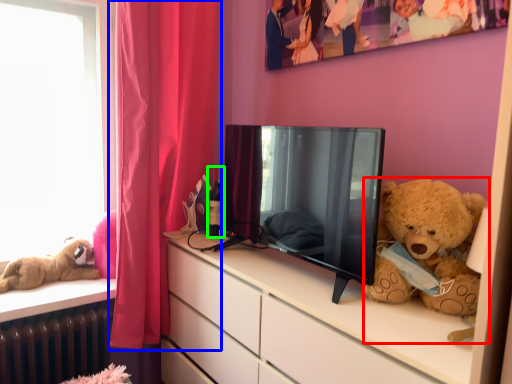
Question: Considering the real-world distances, which object is closest to teddy bear (highlighted by a red box)? curtain (highlighted by a blue box) or bottle (highlighted by a green box).

Choices:
 (A) curtain
 (B) bottle

Answer: (B)